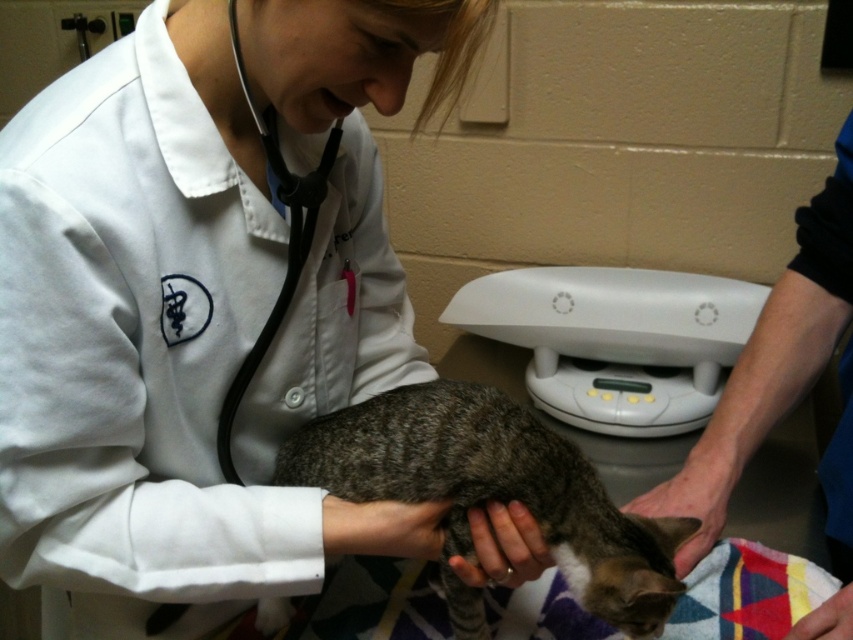
Question: Is the position of white smooth coat at center less distant than that of black rubber stethoscope at center?

Choices:
 (A) no
 (B) yes

Answer: (B)

Question: Which point is farther from the camera taking this photo?

Choices:
 (A) (840, 588)
 (B) (325, 193)
 (C) (4, 461)

Answer: (B)

Question: Which point is closer to the camera?

Choices:
 (A) white smooth coat at center
 (B) gray striped fur cat at center
 (C) white coat at center
 (D) black rubber stethoscope at center

Answer: (A)

Question: Is gray striped fur cat at center below black rubber stethoscope at center?

Choices:
 (A) no
 (B) yes

Answer: (B)

Question: Which of the following is the closest to the observer?

Choices:
 (A) (228, 381)
 (B) (828, 540)
 (C) (314, 173)

Answer: (A)

Question: Is gray striped fur cat at center below black rubber stethoscope at center?

Choices:
 (A) yes
 (B) no

Answer: (A)